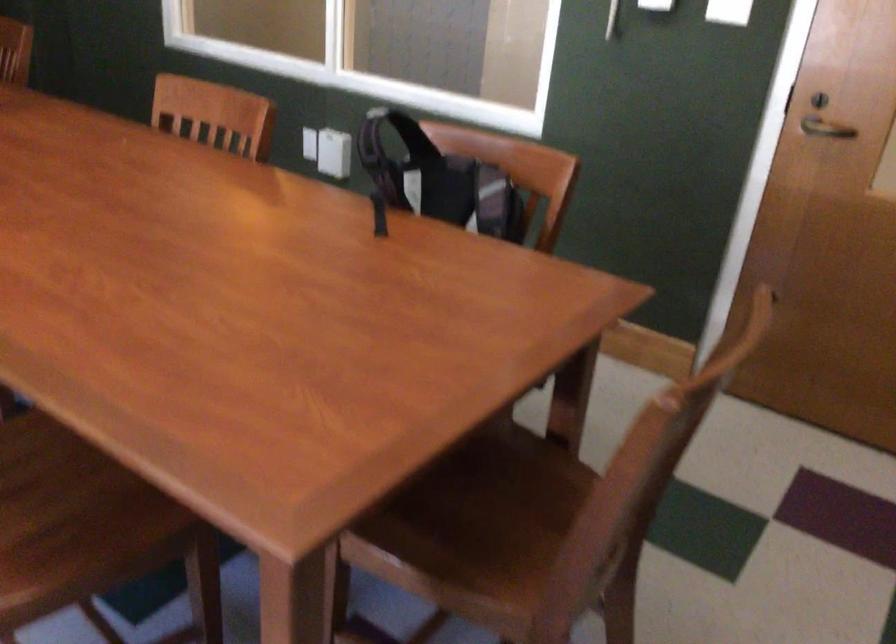
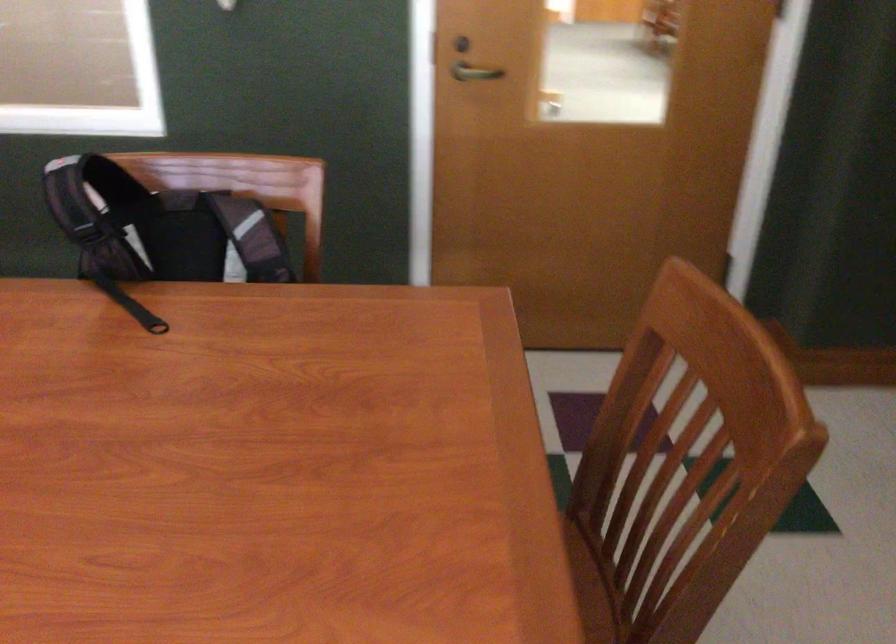
In the second image, find the point that corresponds to (435,178) in the first image.

(159, 228)